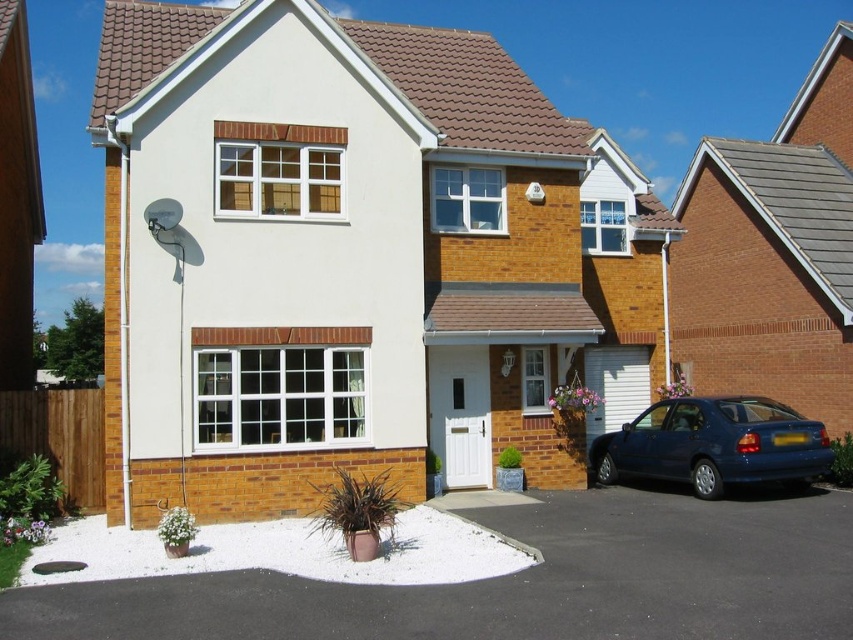
Does black asphalt driveway at lower center appear on the right side of glossy blue sedan at lower right?

Incorrect, black asphalt driveway at lower center is not on the right side of glossy blue sedan at lower right.

Does black asphalt driveway at lower center appear on the left side of glossy blue sedan at lower right?

Correct, you'll find black asphalt driveway at lower center to the left of glossy blue sedan at lower right.

Does point (585, 548) lie in front of point (720, 472)?

Yes, it is in front of point (720, 472).

You are a GUI agent. You are given a task and a screenshot of the screen. Output one action in this format:
    pyautogui.click(x=<x>, y=<y>)
    Task: Click on the black asphalt driveway at lower center
    
    Given the screenshot: What is the action you would take?
    pyautogui.click(x=521, y=580)